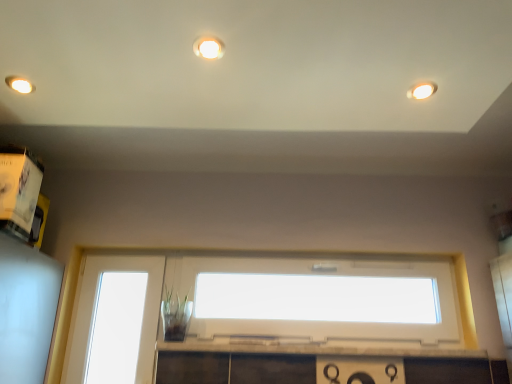
Question: Is matte white light fixture at upper center, which ranks as the 1th lighting in top-to-bottom order, taller or shorter than transparent glass window at lower left, the 1th window in the left-to-right sequence?

Choices:
 (A) tall
 (B) short

Answer: (B)

Question: Is matte white light fixture at upper center, the third lighting when ordered from back to front, to the left or to the right of transparent glass window at lower left, which appears as the 2th window when viewed from the right, in the image?

Choices:
 (A) right
 (B) left

Answer: (A)

Question: Considering the real-world distances, which object is closest to the matte white light fixture at upper center, the third lighting when ordered from back to front?

Choices:
 (A) matte white light fixture at upper right, marked as the 2th lighting in a front-to-back arrangement
 (B) white plastic window at center, the second window from the left
 (C) transparent glass window at lower left, which appears as the 2th window when viewed from the right
 (D) matte white light fixture at upper left, the second lighting viewed from the top

Answer: (D)

Question: Which object is the closest to the white plastic window at center, which is the 1th window from right to left?

Choices:
 (A) matte white light fixture at upper left, the 1th lighting in the left-to-right sequence
 (B) transparent glass window at lower left, the 1th window in the left-to-right sequence
 (C) matte white light fixture at upper right, placed as the second lighting when sorted from back to front
 (D) matte white light fixture at upper center, the third lighting when ordered from back to front

Answer: (B)